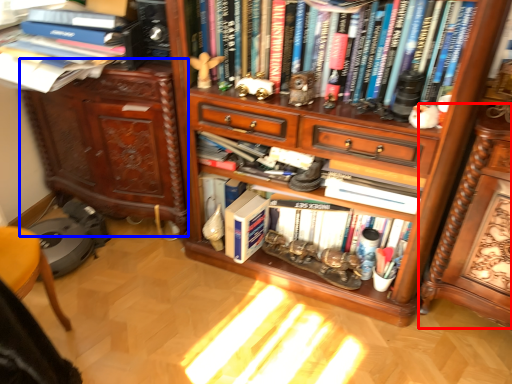
Question: Which object appears closest to the camera in this image, computer desk (highlighted by a red box) or cabinetry (highlighted by a blue box)?

Choices:
 (A) computer desk
 (B) cabinetry

Answer: (A)